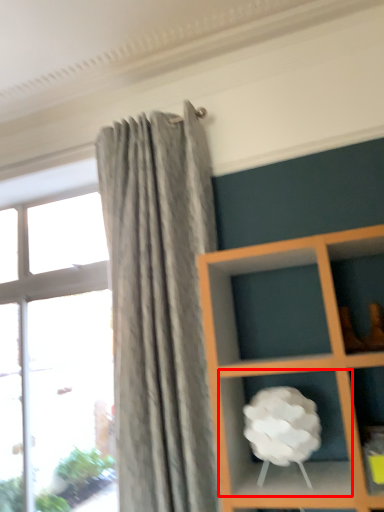
Question: From the image's perspective, what is the correct spatial positioning of cabinet (annotated by the red box) in reference to window?

Choices:
 (A) below
 (B) above

Answer: (B)